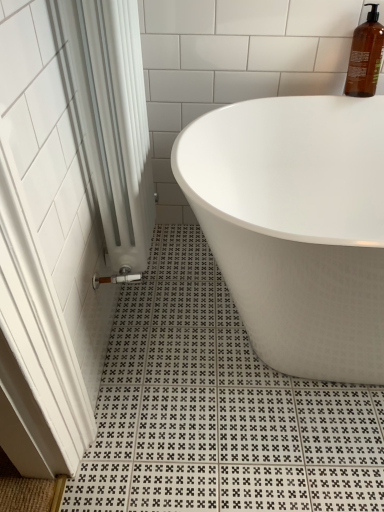
Question: Is white fabric shower curtain at left bigger or smaller than white glossy bathtub at center?

Choices:
 (A) small
 (B) big

Answer: (A)

Question: Considering the positions of point (135, 61) and point (291, 350), is point (135, 61) closer or farther from the camera than point (291, 350)?

Choices:
 (A) closer
 (B) farther

Answer: (A)

Question: Estimate the real-world distances between objects in this image. Which object is closer to the white glossy bathtub at center?

Choices:
 (A) translucent amber bottle at upper right
 (B) white fabric shower curtain at left

Answer: (B)

Question: Estimate the real-world distances between objects in this image. Which object is closer to the translucent amber bottle at upper right?

Choices:
 (A) white glossy bathtub at center
 (B) white fabric shower curtain at left

Answer: (A)